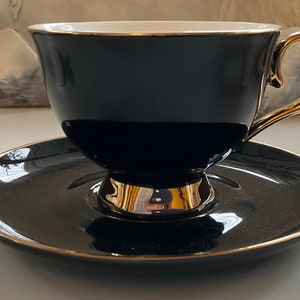
The image size is (300, 300). In order to click on formal dishware in this screenshot , I will do `click(273, 207)`.